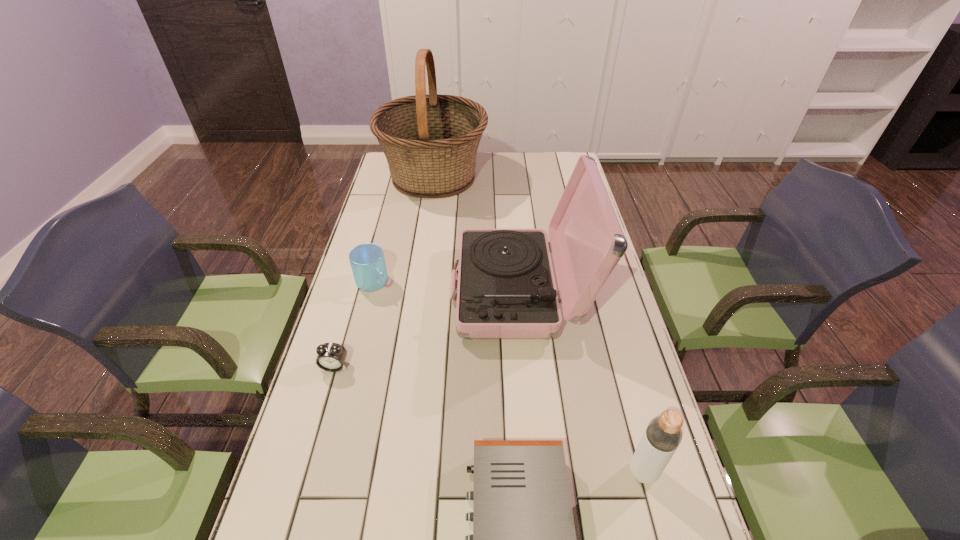
In order to click on the tallest object in this screenshot , I will do `click(430, 141)`.

This screenshot has width=960, height=540. What are the coordinates of `the farthest object` in the screenshot? It's located at (430, 141).

Image resolution: width=960 pixels, height=540 pixels. Find the location of `record player`. record player is located at coordinates (506, 289).

The width and height of the screenshot is (960, 540). What are the coordinates of `bottle` in the screenshot? It's located at (663, 435).

This screenshot has height=540, width=960. Find the location of `the fourth tallest object`. the fourth tallest object is located at coordinates pos(367,261).

Image resolution: width=960 pixels, height=540 pixels. I want to click on alarm clock, so click(x=331, y=356).

You are a GUI agent. You are given a task and a screenshot of the screen. Output one action in this format:
    pyautogui.click(x=<x>, y=<y>)
    Task: Click on the vacant space located on the right of the tallest object
    This screenshot has width=960, height=540.
    Given the screenshot: What is the action you would take?
    pyautogui.click(x=511, y=177)

Identify the location of vacant space situated with the lid open on the fifth shortest object. This screenshot has width=960, height=540. (395, 291).

Where is `vacant space located 0.310m with the lid open on the fifth shortest object`? This screenshot has height=540, width=960. vacant space located 0.310m with the lid open on the fifth shortest object is located at coordinates (353, 291).

Find the location of a particular element. The height and width of the screenshot is (540, 960). vacant area located with the lid open on the fifth shortest object is located at coordinates (417, 291).